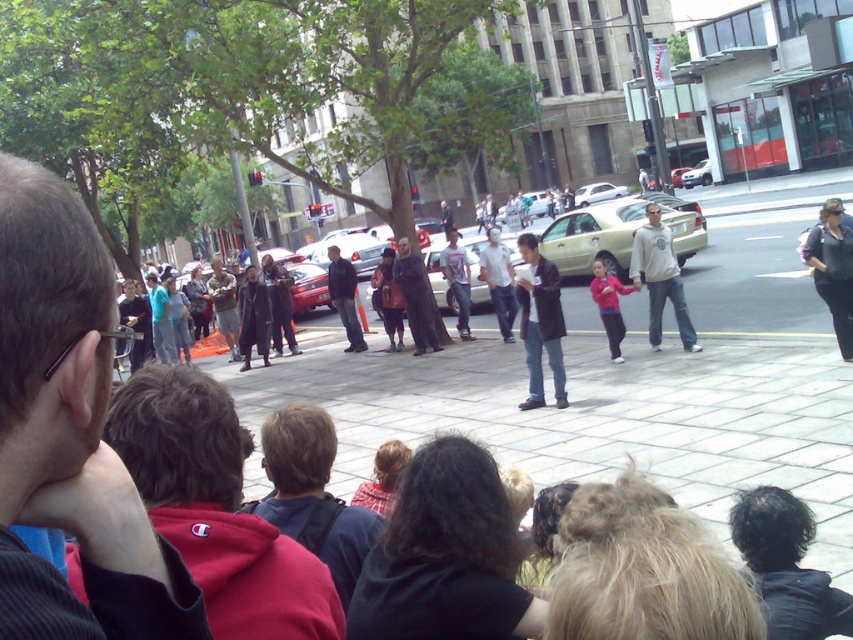
Is dark brown hair at center shorter than dark blue jeans at center?

Indeed, dark brown hair at center has a lesser height compared to dark blue jeans at center.

Is point (103, 285) behind point (538, 285)?

No, (103, 285) is closer to viewer.

This screenshot has width=853, height=640. I want to click on dark brown hair at center, so click(x=70, y=433).

Who is taller, pink fleece jacket at center or light gray jeans at center?

Standing taller between the two is pink fleece jacket at center.

Between point (618, 342) and point (459, 262), which one is positioned in front?

Point (618, 342) is more forward.

This screenshot has height=640, width=853. I want to click on pink fleece jacket at center, so (x=608, y=305).

Which of these two, black matte cape at center or metallic silver sedan at center, stands shorter?

Standing shorter between the two is metallic silver sedan at center.

Can you confirm if black matte cape at center is smaller than metallic silver sedan at center?

Correct, black matte cape at center occupies less space than metallic silver sedan at center.

Which is in front, point (428, 324) or point (701, 180)?

Point (428, 324) is in front.

The width and height of the screenshot is (853, 640). Find the location of `black matte cape at center`. black matte cape at center is located at coordinates (415, 296).